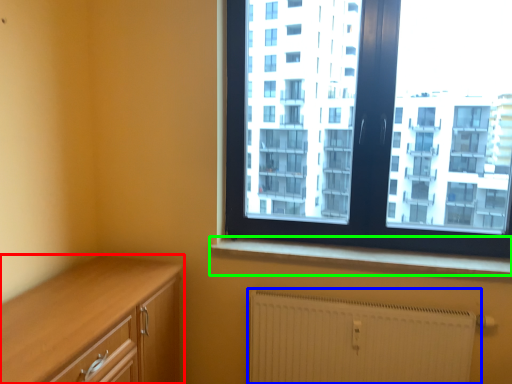
Question: Based on their relative distances, which object is farther from cabinetry (highlighted by a red box)? Choose from radiator (highlighted by a blue box) and window sill (highlighted by a green box).

Choices:
 (A) radiator
 (B) window sill

Answer: (A)